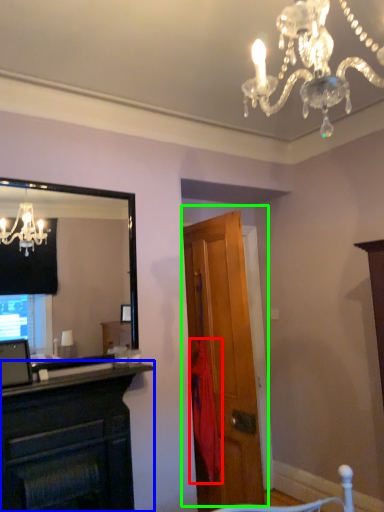
Question: Estimate the real-world distances between objects in this image. Which object is closer to curtain (highlighted by a red box), cabinetry (highlighted by a blue box) or door (highlighted by a green box)?

Choices:
 (A) cabinetry
 (B) door

Answer: (B)